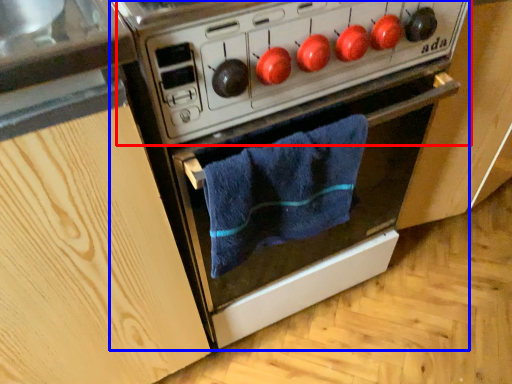
Question: Which point is further to the camera, appliance (highlighted by a red box) or oven (highlighted by a blue box)?

Choices:
 (A) appliance
 (B) oven

Answer: (B)